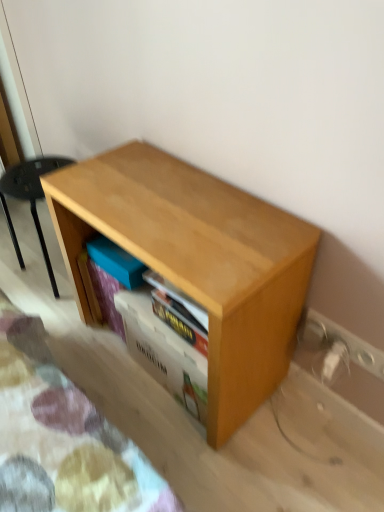
Question: Would you say light wood shelf at lower left is inside or outside white plastic electric outlet at lower right, which is the 2th electric outlet from top to bottom?

Choices:
 (A) outside
 (B) inside

Answer: (A)

Question: Is light wood shelf at lower left taller or shorter than white plastic electric outlet at lower right, which ranks as the 1th electric outlet in bottom-to-top order?

Choices:
 (A) short
 (B) tall

Answer: (B)

Question: Estimate the real-world distances between objects in this image. Which object is closer to the white plastic electric outlet at lower right, which is counted as the second electric outlet, starting from the bottom?

Choices:
 (A) wooden shelf at center
 (B) light wood table at center
 (C) light wood shelf at lower left
 (D) white plastic electric outlet at lower right, which is the 2th electric outlet from top to bottom

Answer: (D)

Question: Which is nearer to the light wood shelf at lower left?

Choices:
 (A) white plastic electric outlet at lower right, which ranks as the 1th electric outlet in top-to-bottom order
 (B) wooden shelf at center
 (C) white plastic electric outlet at lower right, which ranks as the 1th electric outlet in bottom-to-top order
 (D) light wood table at center

Answer: (D)